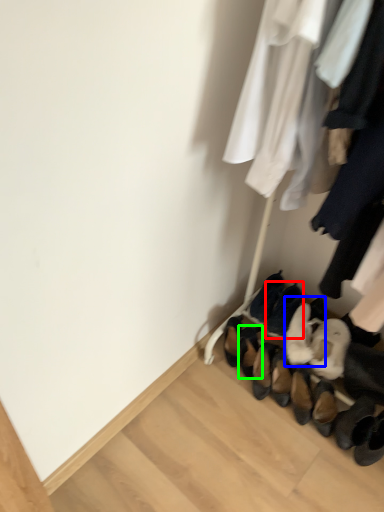
Question: Based on their relative distances, which object is nearer to footwear (highlighted by a red box)? Choose from footwear (highlighted by a blue box) and footwear (highlighted by a green box).

Choices:
 (A) footwear
 (B) footwear

Answer: (A)